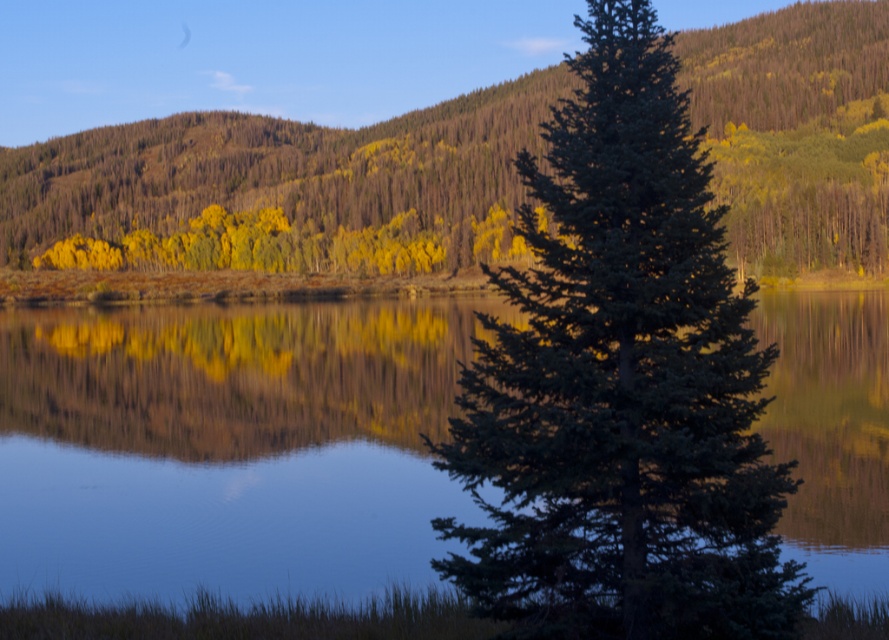
Does green matte tree at center appear under yellow-green foliage at upper center?

Yes, green matte tree at center is below yellow-green foliage at upper center.

Which is more to the left, green matte tree at center or yellow-green foliage at upper center?

yellow-green foliage at upper center is more to the left.

The image size is (889, 640). I want to click on green matte tree at center, so click(x=621, y=385).

At what (x,y) coordinates should I click in order to perform the action: click on green matte tree at center. Please return your answer as a coordinate pair (x, y). The width and height of the screenshot is (889, 640). Looking at the image, I should click on (621, 385).

Is point (831, 388) farther from camera compared to point (189, 172)?

That is False.

Between transparent water at center and yellow-green foliage at upper center, which one appears on the left side from the viewer's perspective?

From the viewer's perspective, yellow-green foliage at upper center appears more on the left side.

Describe the element at coordinates (228, 445) in the screenshot. The image size is (889, 640). I see `transparent water at center` at that location.

Locate an element on the screen. The height and width of the screenshot is (640, 889). transparent water at center is located at coordinates (228, 445).

Is transparent water at center wider than green matte tree at center?

Yes.

Locate an element on the screen. The height and width of the screenshot is (640, 889). transparent water at center is located at coordinates (228, 445).